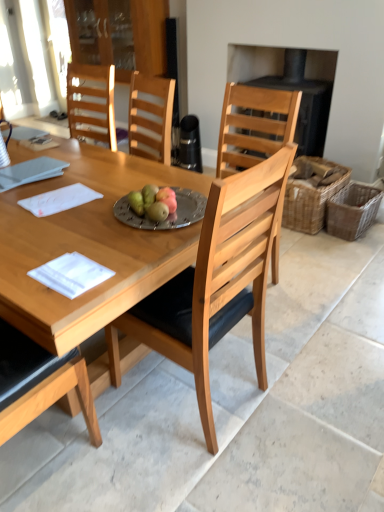
The width and height of the screenshot is (384, 512). Find the location of `free space in front of woven brown picnic basket at right, which is the second picnic basket in left-to-right order`. free space in front of woven brown picnic basket at right, which is the second picnic basket in left-to-right order is located at coordinates (346, 249).